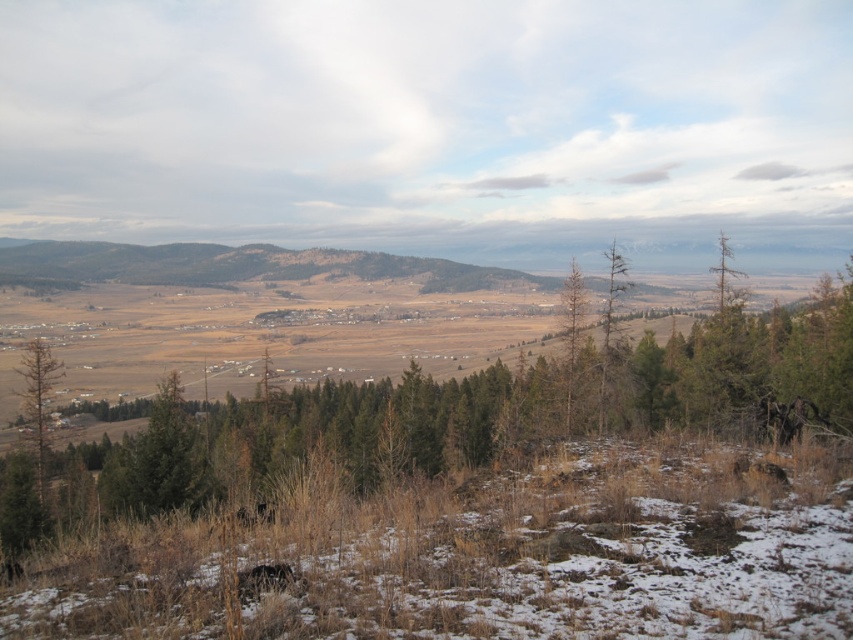
You are standing at the highest point of the landscape and want to walk to the green matte tree at left. Which direction should you head to reach it first, considering the green matte tree at center is in your way?

The green matte tree at center is closer to the viewer than the green matte tree at left, so you would need to first walk past the green matte tree at center to reach the green matte tree at left.